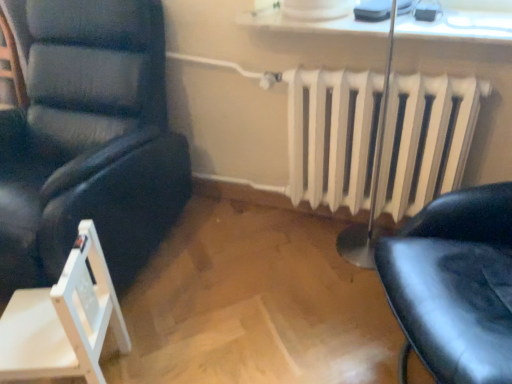
Question: Could you tell me if white glossy window sill at upper center is turned towards white wood folding chair at lower left, marked as the second chair in a top-to-bottom arrangement?

Choices:
 (A) no
 (B) yes

Answer: (A)

Question: Does white glossy window sill at upper center have a greater width compared to white wood folding chair at lower left, the first chair ordered from the bottom?

Choices:
 (A) yes
 (B) no

Answer: (A)

Question: Is white glossy window sill at upper center smaller than white wood folding chair at lower left, the first chair ordered from the bottom?

Choices:
 (A) yes
 (B) no

Answer: (A)

Question: Is white glossy window sill at upper center looking in the opposite direction of white wood folding chair at lower left, marked as the second chair in a top-to-bottom arrangement?

Choices:
 (A) no
 (B) yes

Answer: (A)

Question: Are white glossy window sill at upper center and white wood folding chair at lower left, the first chair ordered from the bottom, located far from each other?

Choices:
 (A) yes
 (B) no

Answer: (A)

Question: Considering the relative positions of white glossy window sill at upper center and white wood folding chair at lower left, the first chair ordered from the bottom, in the image provided, is white glossy window sill at upper center to the left of white wood folding chair at lower left, the first chair ordered from the bottom, from the viewer's perspective?

Choices:
 (A) no
 (B) yes

Answer: (A)

Question: Is white wood folding chair at lower left, the first chair ordered from the bottom, smaller than white painted metal radiator at center?

Choices:
 (A) yes
 (B) no

Answer: (A)

Question: Does white wood folding chair at lower left, the first chair ordered from the bottom, have a lesser height compared to white painted metal radiator at center?

Choices:
 (A) no
 (B) yes

Answer: (B)

Question: Is white wood folding chair at lower left, the first chair ordered from the bottom, looking in the opposite direction of white painted metal radiator at center?

Choices:
 (A) yes
 (B) no

Answer: (B)

Question: Can you confirm if white wood folding chair at lower left, the first chair ordered from the bottom, is positioned to the left of white painted metal radiator at center?

Choices:
 (A) yes
 (B) no

Answer: (A)

Question: From the image's perspective, would you say white wood folding chair at lower left, the first chair ordered from the bottom, is shown under white painted metal radiator at center?

Choices:
 (A) yes
 (B) no

Answer: (A)

Question: Is the position of white wood folding chair at lower left, marked as the second chair in a top-to-bottom arrangement, less distant than that of white painted metal radiator at center?

Choices:
 (A) no
 (B) yes

Answer: (B)

Question: From a real-world perspective, does matte black chair at left, which is counted as the first chair, starting from the top, sit lower than white glossy window sill at upper center?

Choices:
 (A) yes
 (B) no

Answer: (A)